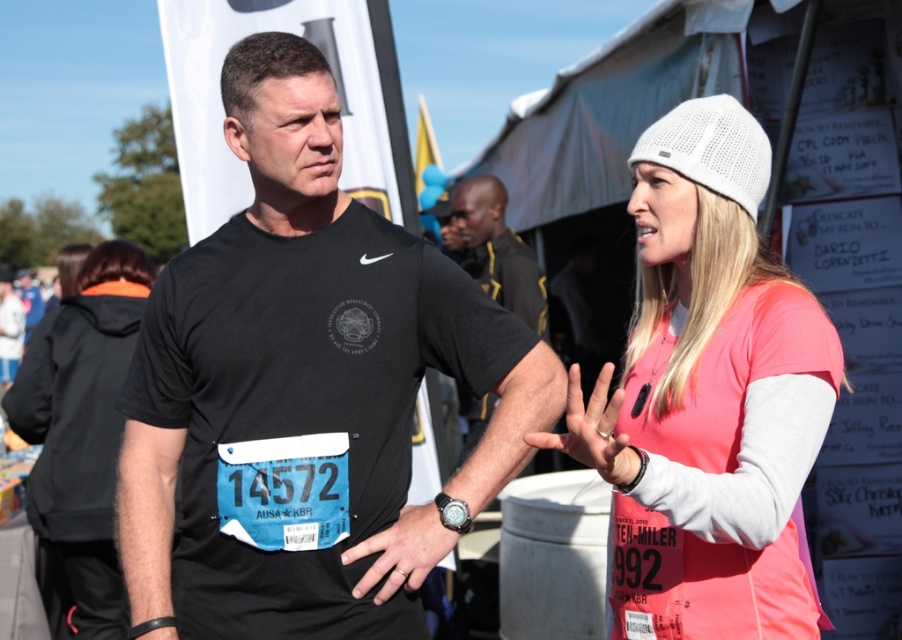
Question: Among these points, which one is farthest from the camera?

Choices:
 (A) (426, 564)
 (B) (97, 557)

Answer: (B)

Question: Is black fleece jacket at left smaller than matte silver ring at center?

Choices:
 (A) yes
 (B) no

Answer: (B)

Question: Is black matte t-shirt at center in front of matte silver ring at center?

Choices:
 (A) yes
 (B) no

Answer: (B)

Question: Is pink fabric beanie at upper right below black leather watch at center?

Choices:
 (A) yes
 (B) no

Answer: (B)

Question: Which object is the farthest from the black fleece jacket at left?

Choices:
 (A) pink fabric beanie at upper right
 (B) black matte t-shirt at center
 (C) black leather watch at center
 (D) matte silver ring at center

Answer: (A)

Question: Which point appears closest to the camera in this image?

Choices:
 (A) (x=482, y=195)
 (B) (x=615, y=410)

Answer: (B)